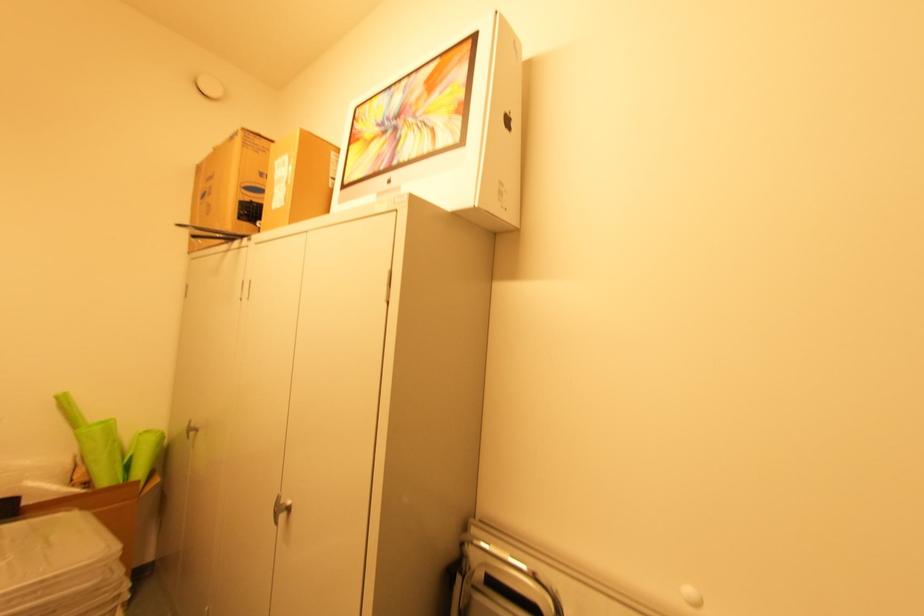
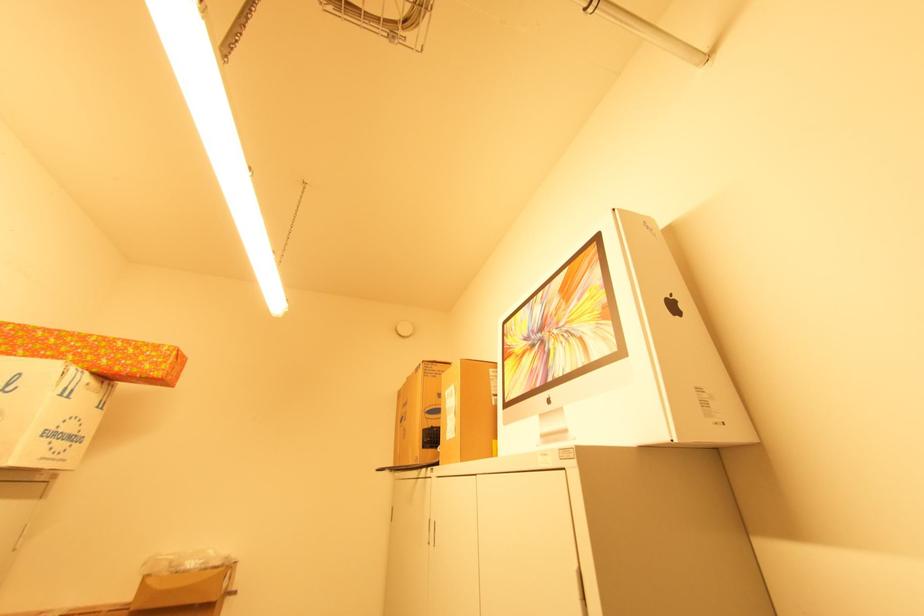
How did the camera likely rotate?

The camera's rotation is toward left-up.